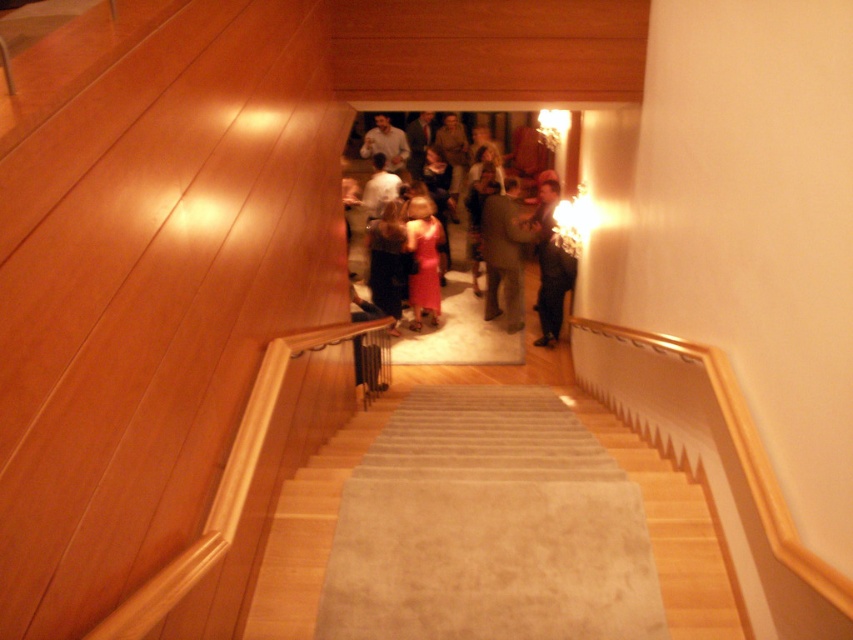
You are standing at the top of the beige carpeted stairs at center and want to see the matte pink dress at center at the bottom. Is the dress visible from your current position?

The beige carpeted stairs at center is in front of the matte pink dress at center, so the dress might be partially or fully blocked from view by the stairs.

You are standing at the top of the beige carpeted stairs at center. You want to walk down to the group of people at the bottom. Is the matte brown suit at center in your direct path?

The beige carpeted stairs at center is positioned under the matte brown suit at center, meaning the matte brown suit at center is directly above the stairs. Therefore, the matte brown suit at center is in your direct path as you walk down the beige carpeted stairs at center.

You are standing at the top of the beige carpeted stairs at center and want to greet the person wearing the matte pink dress at center. Which direction should you move to reach them?

You should move to your left because the beige carpeted stairs at center are to the right of the matte pink dress at center, so moving left will bring you towards the matte pink dress at center.